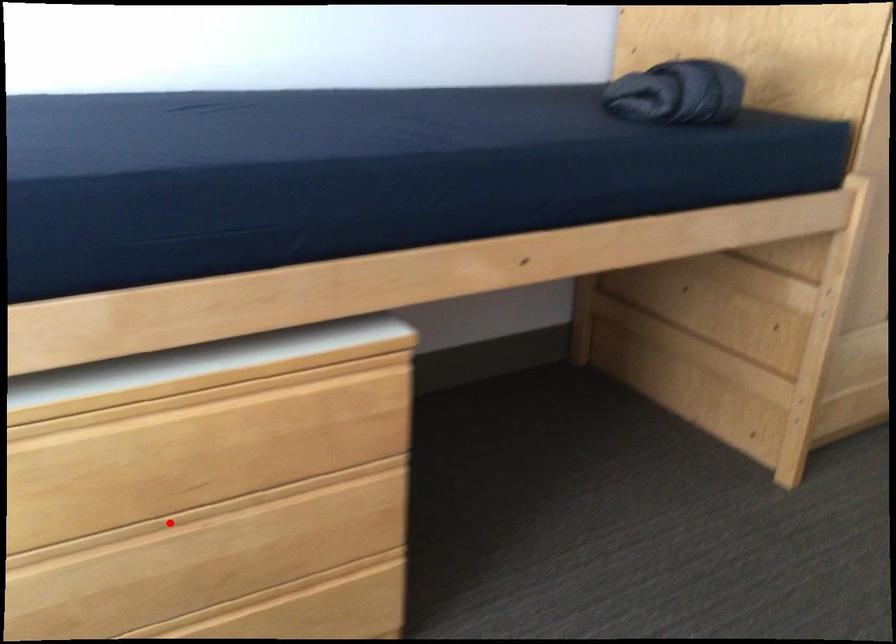
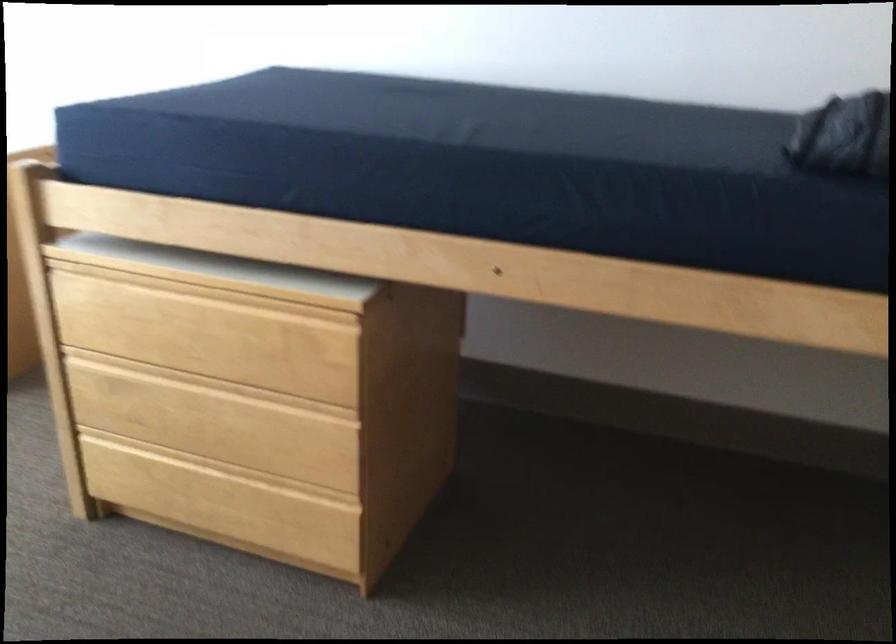
In the second image, find the point that corresponds to the highlighted location in the first image.

(194, 381)